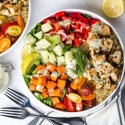
What are the coordinates of `blurry white bowl` in the screenshot? It's located at (80, 10), (93, 16), (122, 78), (87, 108), (83, 111), (57, 110).